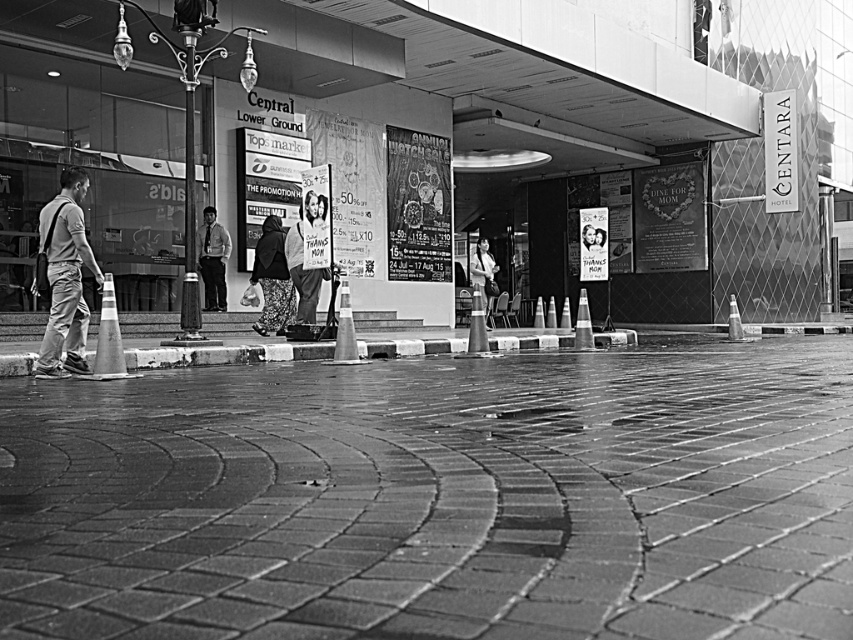
Looking at this image, does smooth concrete pavement at center have a lesser height compared to matte white sign at center?

Correct, smooth concrete pavement at center is not as tall as matte white sign at center.

Which is more to the right, smooth concrete pavement at center or matte white sign at center?

From the viewer's perspective, smooth concrete pavement at center appears more on the right side.

Is point (724, 392) closer to viewer compared to point (296, 262)?

Yes, it is in front of point (296, 262).

Identify the location of smooth concrete pavement at center. (437, 499).

Which is above, smooth concrete pavement at center or floral-patterned pants at center?

floral-patterned pants at center is higher up.

Between smooth concrete pavement at center and floral-patterned pants at center, which one appears on the right side from the viewer's perspective?

smooth concrete pavement at center

Between point (819, 572) and point (262, 243), which one is positioned in front?

Point (819, 572) is in front.

Image resolution: width=853 pixels, height=640 pixels. In order to click on smooth concrete pavement at center in this screenshot , I will do `click(437, 499)`.

Between point (293, 285) and point (212, 244), which one is positioned in front?

Point (293, 285)

Can you confirm if floral-patterned pants at center is positioned above light brown shirt at center?

No.

This screenshot has height=640, width=853. What do you see at coordinates (271, 278) in the screenshot? I see `floral-patterned pants at center` at bounding box center [271, 278].

The height and width of the screenshot is (640, 853). I want to click on floral-patterned pants at center, so click(x=271, y=278).